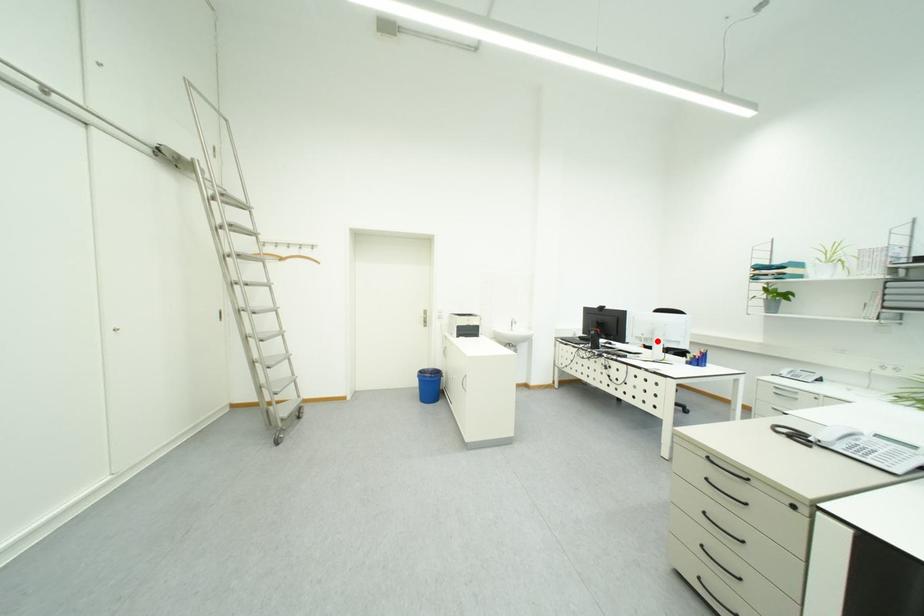
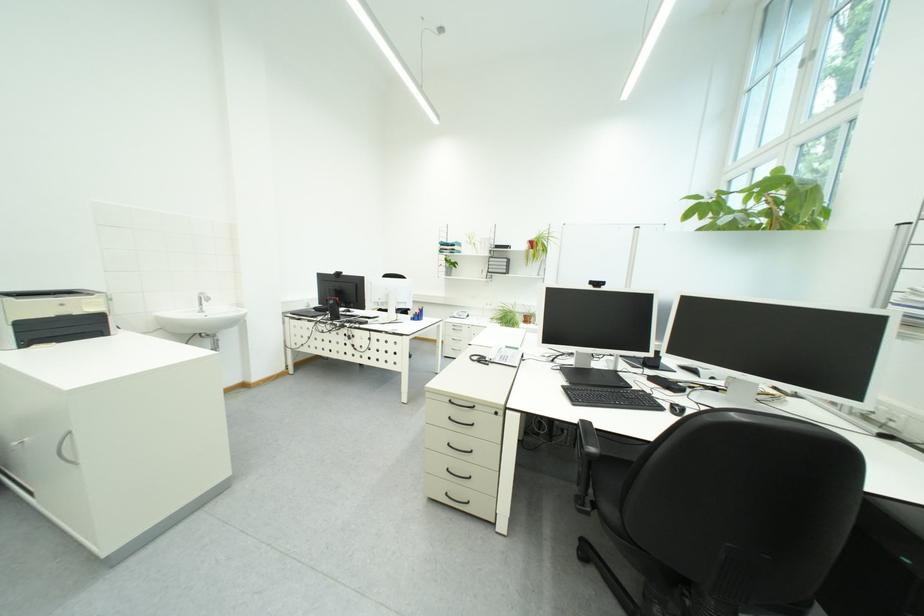
Question: I am providing you with two images of the same scene from different viewpoints. A red point is shown in image1. For the corresponding object point in image2, is it positioned nearer or farther from the camera?

Choices:
 (A) Nearer
 (B) Farther

Answer: (A)